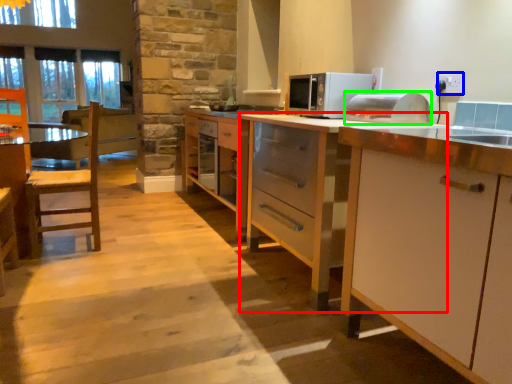
Question: Based on their relative distances, which object is farther from cabinetry (highlighted by a red box)? Choose from electric outlet (highlighted by a blue box) and appliance (highlighted by a green box).

Choices:
 (A) electric outlet
 (B) appliance

Answer: (A)